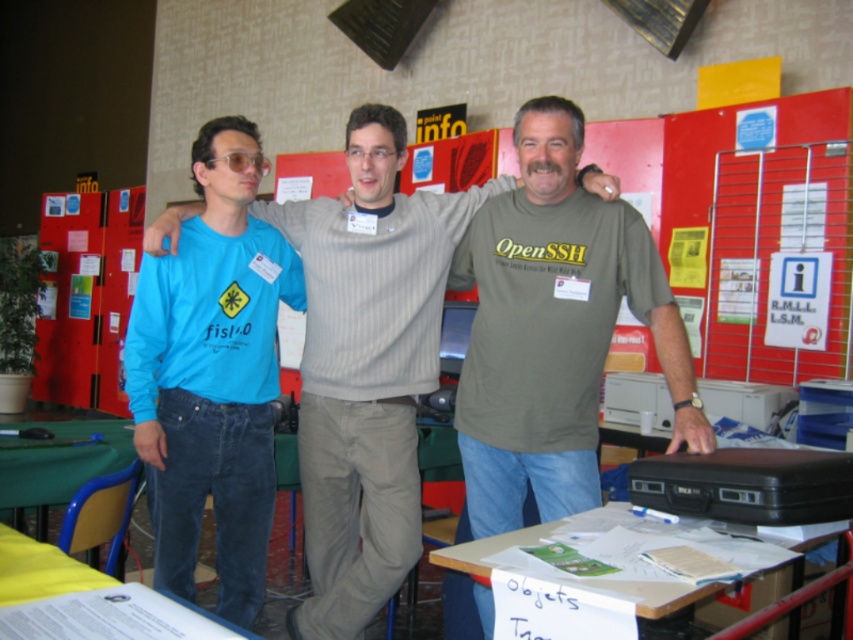
Does matte blue shirt at left appear under yellow paper at lower left?

No.

Which is in front, point (285, 301) or point (236, 627)?

Point (236, 627) is more forward.

This screenshot has width=853, height=640. Identify the location of matte blue shirt at left. (212, 378).

Can you confirm if green fabric table at lower left is shorter than yellow paper at lower left?

No, green fabric table at lower left is not shorter than yellow paper at lower left.

Between green fabric table at lower left and yellow paper at lower left, which one appears on the left side from the viewer's perspective?

green fabric table at lower left

Who is more forward, [90,480] or [80,577]?

Point [80,577] is more forward.

This screenshot has width=853, height=640. In order to click on green fabric table at lower left in this screenshot , I will do `click(59, 465)`.

Does white paper at lower center appear on the right side of yellow paper at lower left?

Yes, white paper at lower center is to the right of yellow paper at lower left.

Is white paper at lower center wider than yellow paper at lower left?

Indeed, white paper at lower center has a greater width compared to yellow paper at lower left.

This screenshot has width=853, height=640. What do you see at coordinates (514, 541) in the screenshot?
I see `white paper at lower center` at bounding box center [514, 541].

This screenshot has height=640, width=853. Identify the location of white paper at lower center. pos(514,541).